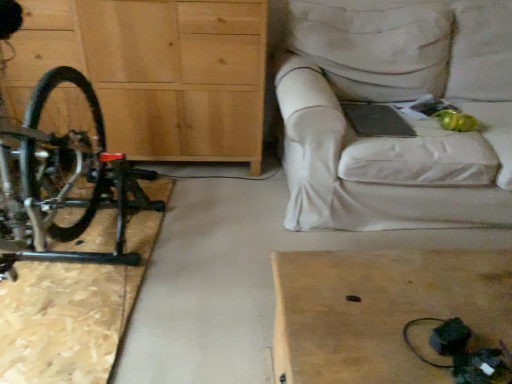
Question: From a real-world perspective, does light brown wooden table at lower right sit lower than white fabric couch at upper right?

Choices:
 (A) yes
 (B) no

Answer: (A)

Question: Considering the relative positions of light brown wooden table at lower right and white fabric couch at upper right in the image provided, is light brown wooden table at lower right to the right of white fabric couch at upper right from the viewer's perspective?

Choices:
 (A) yes
 (B) no

Answer: (B)

Question: Can you confirm if light brown wooden table at lower right is taller than white fabric couch at upper right?

Choices:
 (A) yes
 (B) no

Answer: (B)

Question: From the image's perspective, is light brown wooden table at lower right beneath white fabric couch at upper right?

Choices:
 (A) yes
 (B) no

Answer: (A)

Question: Is light brown wooden table at lower right bigger than white fabric couch at upper right?

Choices:
 (A) yes
 (B) no

Answer: (B)

Question: Is light brown wooden table at lower right positioned with its back to white fabric couch at upper right?

Choices:
 (A) yes
 (B) no

Answer: (A)

Question: Is black matte bicycle at left at the left side of white fabric couch at upper right?

Choices:
 (A) no
 (B) yes

Answer: (B)

Question: Is black matte bicycle at left located outside white fabric couch at upper right?

Choices:
 (A) yes
 (B) no

Answer: (A)

Question: Is black matte bicycle at left thinner than white fabric couch at upper right?

Choices:
 (A) no
 (B) yes

Answer: (A)

Question: Considering the relative positions of black matte bicycle at left and white fabric couch at upper right in the image provided, is black matte bicycle at left to the right of white fabric couch at upper right from the viewer's perspective?

Choices:
 (A) no
 (B) yes

Answer: (A)

Question: Is black matte bicycle at left positioned with its back to white fabric couch at upper right?

Choices:
 (A) yes
 (B) no

Answer: (B)

Question: From the image's perspective, is black matte bicycle at left beneath white fabric couch at upper right?

Choices:
 (A) yes
 (B) no

Answer: (A)

Question: Considering the relative sizes of light brown wooden table at lower right and black matte bicycle at left in the image provided, is light brown wooden table at lower right wider than black matte bicycle at left?

Choices:
 (A) yes
 (B) no

Answer: (B)